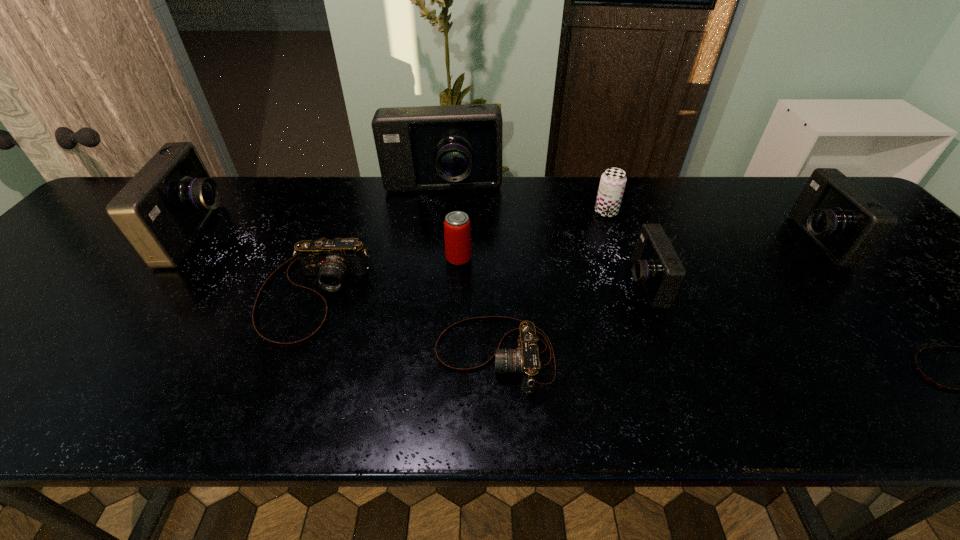
Locate an element on the screen. the smallest blue camera is located at coordinates (656, 265).

I want to click on the second blue camera from right to left, so (656, 265).

Identify the location of the third shortest camera. (331, 261).

Find the location of a particular element. The image size is (960, 540). the biggest brown camera is located at coordinates (331, 261).

This screenshot has width=960, height=540. Find the location of `the second brown camera from right to left`. the second brown camera from right to left is located at coordinates (524, 360).

At what (x,y) coordinates should I click in order to perform the action: click on the sixth tallest camera. Please return your answer as a coordinate pair (x, y). This screenshot has width=960, height=540. Looking at the image, I should click on (524, 360).

Where is `free space located 0.110m on the front-facing side of the biggest blue camera`? The width and height of the screenshot is (960, 540). free space located 0.110m on the front-facing side of the biggest blue camera is located at coordinates point(438,228).

This screenshot has width=960, height=540. What are the coordinates of `vacant space situated on the front-facing side of the leftmost blue camera` in the screenshot? It's located at [255, 234].

Identify the location of vacant space situated 0.330m on the front-facing side of the third biggest blue camera. (668, 241).

Locate an element on the screen. This screenshot has width=960, height=540. free space located 0.080m on the front-facing side of the third biggest blue camera is located at coordinates (763, 241).